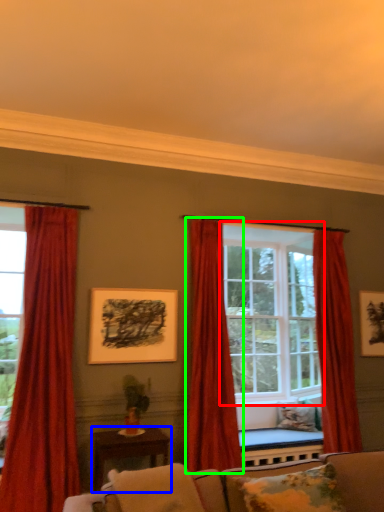
Question: Estimate the real-world distances between objects in this image. Which object is closer to window (highlighted by a red box), table (highlighted by a blue box) or curtain (highlighted by a green box)?

Choices:
 (A) table
 (B) curtain

Answer: (B)